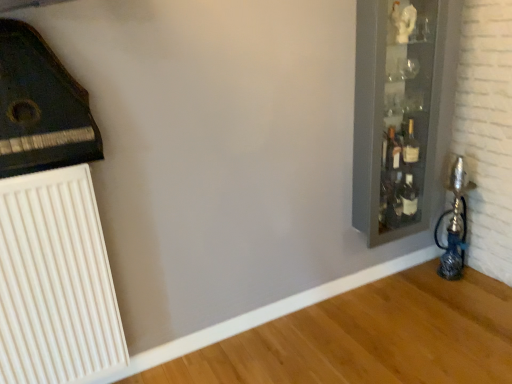
Question: Is white plastic radiator at lower left directly adjacent to translucent glass bottle at right?

Choices:
 (A) no
 (B) yes

Answer: (A)

Question: From the image's perspective, is white plastic radiator at lower left located beneath translucent glass bottle at right?

Choices:
 (A) no
 (B) yes

Answer: (B)

Question: Considering the relative sizes of white plastic radiator at lower left and translucent glass bottle at right in the image provided, is white plastic radiator at lower left shorter than translucent glass bottle at right?

Choices:
 (A) no
 (B) yes

Answer: (A)

Question: From a real-world perspective, is white plastic radiator at lower left on top of translucent glass bottle at right?

Choices:
 (A) yes
 (B) no

Answer: (B)

Question: From a real-world perspective, does white plastic radiator at lower left sit lower than translucent glass bottle at right?

Choices:
 (A) yes
 (B) no

Answer: (A)

Question: Can translucent glass bottle at right be found inside white plastic radiator at lower left?

Choices:
 (A) no
 (B) yes

Answer: (A)

Question: Can you confirm if clear glass cabinet at right is positioned to the left of white plastic radiator at lower left?

Choices:
 (A) yes
 (B) no

Answer: (B)

Question: Does clear glass cabinet at right have a smaller size compared to white plastic radiator at lower left?

Choices:
 (A) no
 (B) yes

Answer: (A)

Question: From a real-world perspective, is clear glass cabinet at right physically below white plastic radiator at lower left?

Choices:
 (A) no
 (B) yes

Answer: (A)

Question: Does clear glass cabinet at right have a greater height compared to white plastic radiator at lower left?

Choices:
 (A) yes
 (B) no

Answer: (A)

Question: Considering the relative sizes of clear glass cabinet at right and white plastic radiator at lower left in the image provided, is clear glass cabinet at right thinner than white plastic radiator at lower left?

Choices:
 (A) yes
 (B) no

Answer: (B)

Question: Is clear glass cabinet at right bigger than white plastic radiator at lower left?

Choices:
 (A) no
 (B) yes

Answer: (B)

Question: Can you confirm if white plastic radiator at lower left is taller than clear glass cabinet at right?

Choices:
 (A) no
 (B) yes

Answer: (A)